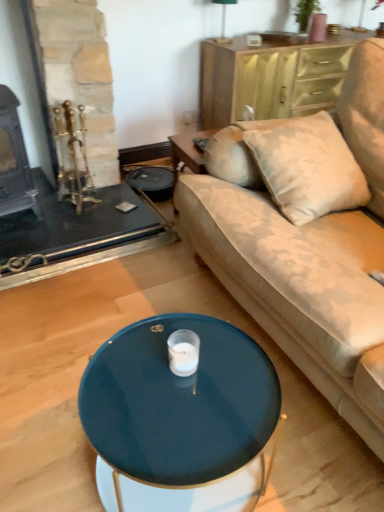
Question: Is glossy dark blue coffee table at center located within green fabric lampshade at upper center?

Choices:
 (A) no
 (B) yes

Answer: (A)

Question: Is green fabric lampshade at upper center positioned in front of glossy dark blue coffee table at center?

Choices:
 (A) yes
 (B) no

Answer: (B)

Question: From the image's perspective, is green fabric lampshade at upper center on top of glossy dark blue coffee table at center?

Choices:
 (A) no
 (B) yes

Answer: (B)

Question: Are green fabric lampshade at upper center and glossy dark blue coffee table at center making contact?

Choices:
 (A) no
 (B) yes

Answer: (A)

Question: Is green fabric lampshade at upper center wider than glossy dark blue coffee table at center?

Choices:
 (A) yes
 (B) no

Answer: (B)

Question: From the image's perspective, relative to velvet beige couch at center, is wooden dresser at upper right above or below?

Choices:
 (A) above
 (B) below

Answer: (A)

Question: Considering the positions of point (208, 66) and point (352, 160), is point (208, 66) closer or farther from the camera than point (352, 160)?

Choices:
 (A) closer
 (B) farther

Answer: (B)

Question: Relative to velvet beige couch at center, is wooden dresser at upper right in front or behind?

Choices:
 (A) front
 (B) behind

Answer: (B)

Question: Is wooden dresser at upper right situated inside velvet beige couch at center or outside?

Choices:
 (A) inside
 (B) outside

Answer: (B)

Question: From their relative heights in the image, would you say velvet beige couch at center is taller or shorter than wooden dresser at upper right?

Choices:
 (A) tall
 (B) short

Answer: (A)

Question: In terms of size, does velvet beige couch at center appear bigger or smaller than wooden dresser at upper right?

Choices:
 (A) small
 (B) big

Answer: (B)

Question: Is velvet beige couch at center in front of or behind wooden dresser at upper right in the image?

Choices:
 (A) behind
 (B) front

Answer: (B)

Question: From a real-world perspective, is velvet beige couch at center above or below wooden dresser at upper right?

Choices:
 (A) above
 (B) below

Answer: (A)

Question: Looking at the image, does velvet beige couch at center seem bigger or smaller compared to green fabric lampshade at upper center?

Choices:
 (A) big
 (B) small

Answer: (A)

Question: Is point (271, 203) positioned closer to the camera than point (228, 1)?

Choices:
 (A) closer
 (B) farther

Answer: (A)